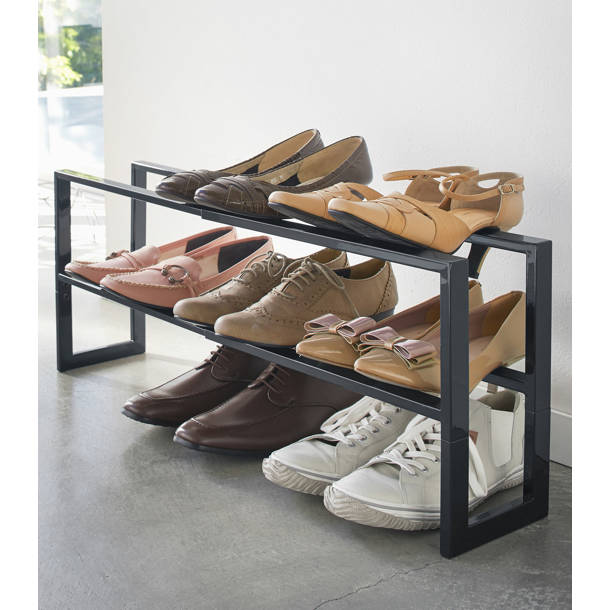
This screenshot has width=610, height=610. Identify the location of shoes on bottom shelf of shoe rack. (112, 260), (157, 279), (196, 302), (248, 320), (331, 348), (384, 370).